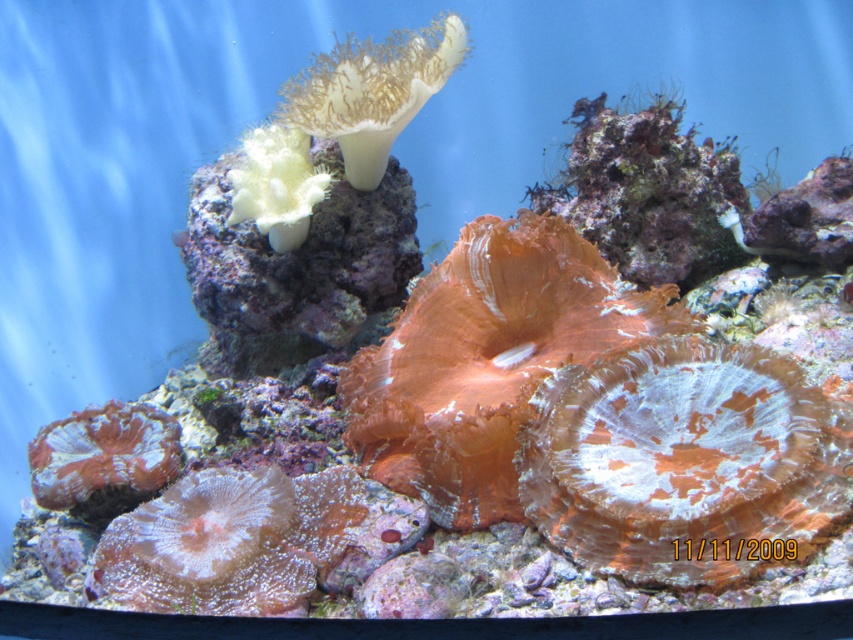
Question: In this image, where is orange coral at center located relative to white soft coral at upper left?

Choices:
 (A) above
 (B) below

Answer: (B)

Question: Is the position of orange translucent coral at center less distant than that of orange coral at lower left?

Choices:
 (A) no
 (B) yes

Answer: (B)

Question: Which point is closer to the camera?

Choices:
 (A) (274, 227)
 (B) (480, 403)
 (C) (67, 436)
 (D) (660, 563)

Answer: (D)

Question: Which is farther from the orange translucent coral at center?

Choices:
 (A) white soft coral at upper center
 (B) white soft coral at upper left

Answer: (B)

Question: Does translucent coral at lower left have a lesser width compared to orange coral at lower left?

Choices:
 (A) no
 (B) yes

Answer: (A)

Question: Which object is the closest to the white soft coral at upper center?

Choices:
 (A) orange translucent coral at center
 (B) translucent coral at lower left
 (C) white soft coral at upper left
 (D) orange coral at lower left

Answer: (C)